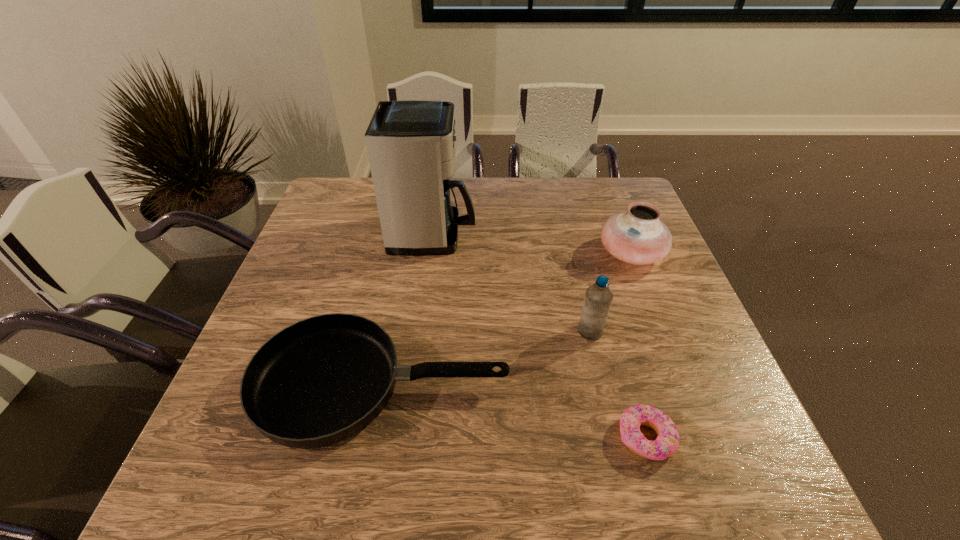
Where is `object that is at the far edge`? object that is at the far edge is located at coordinates (411, 144).

You are a GUI agent. You are given a task and a screenshot of the screen. Output one action in this format:
    pyautogui.click(x=<x>, y=<y>)
    Task: Click on the frying pan that is at the near edge
    
    Given the screenshot: What is the action you would take?
    pyautogui.click(x=321, y=380)

Find the location of a particular element. doughnut that is at the near edge is located at coordinates (667, 442).

This screenshot has width=960, height=540. Find the location of `object that is at the left edge`. object that is at the left edge is located at coordinates (321, 380).

Identify the location of pottery present at the right edge. This screenshot has height=540, width=960. click(x=637, y=236).

Find the location of a particular element. The width and height of the screenshot is (960, 540). doughnut positioned at the right edge is located at coordinates (667, 442).

The width and height of the screenshot is (960, 540). Identify the location of object at the near left corner. (321, 380).

Locate an element on the screen. object present at the near right corner is located at coordinates (667, 442).

Locate an element on the screen. This screenshot has width=960, height=540. vacant space at the far edge of the desktop is located at coordinates (484, 210).

You are a GUI agent. You are given a task and a screenshot of the screen. Output one action in this format:
    pyautogui.click(x=<x>, y=<y>)
    Task: Click on the vacant point at the near edge
    The height and width of the screenshot is (540, 960).
    Given the screenshot: What is the action you would take?
    pos(414,487)